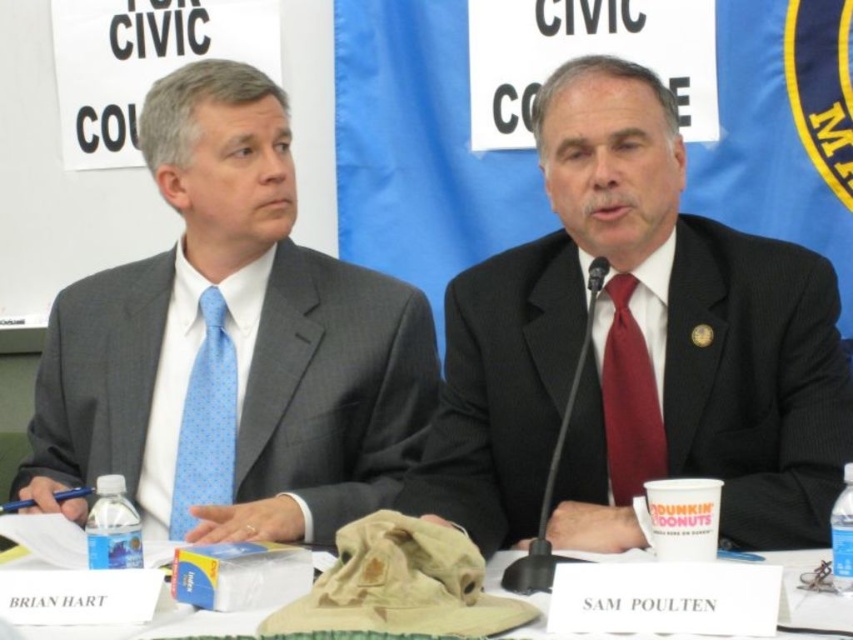
Question: Which of the following is the closest to the observer?

Choices:
 (A) (619, 260)
 (B) (215, 476)
 (C) (212, 228)
 (D) (613, 445)

Answer: (D)

Question: Which point is farther to the camera?

Choices:
 (A) white paper at center
 (B) blue dotted tie at left
 (C) red satin tie at center

Answer: (B)

Question: Which is farther from the white paper at center?

Choices:
 (A) red satin tie at center
 (B) blue dotted tie at left
 (C) matte black suit at center

Answer: (B)

Question: Does matte gray suit at center appear under red satin tie at center?

Choices:
 (A) yes
 (B) no

Answer: (B)

Question: In this image, where is matte gray suit at center located relative to white paper at center?

Choices:
 (A) right
 (B) left

Answer: (B)

Question: Is matte black suit at center thinner than matte gray suit at center?

Choices:
 (A) yes
 (B) no

Answer: (A)